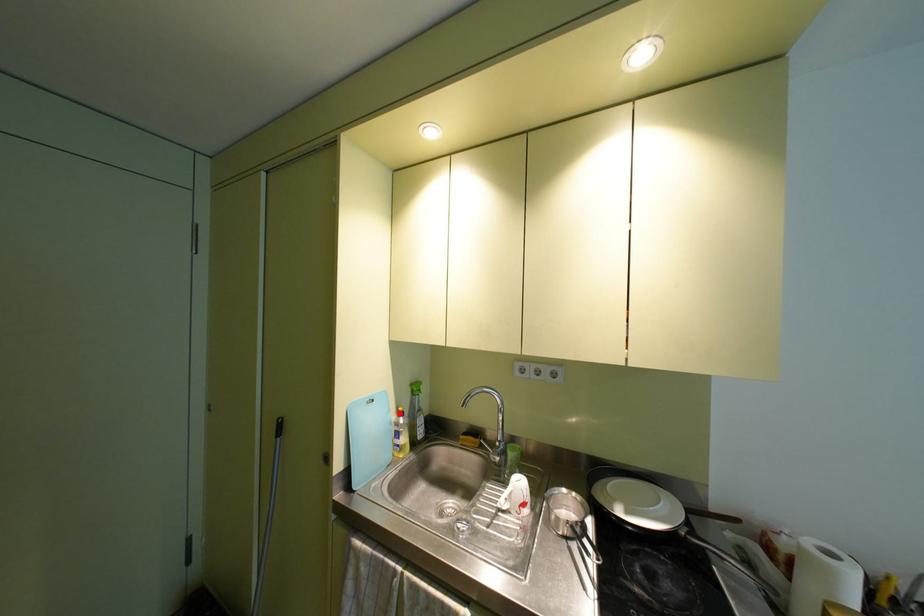
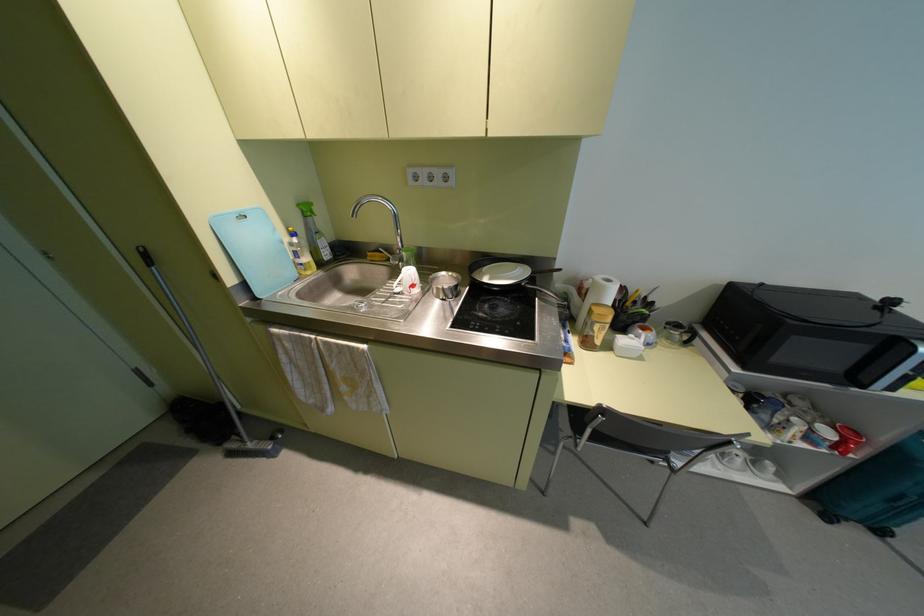
The point at the highlighted location is marked in the first image. Where is the corresponding point in the second image?

(293, 233)